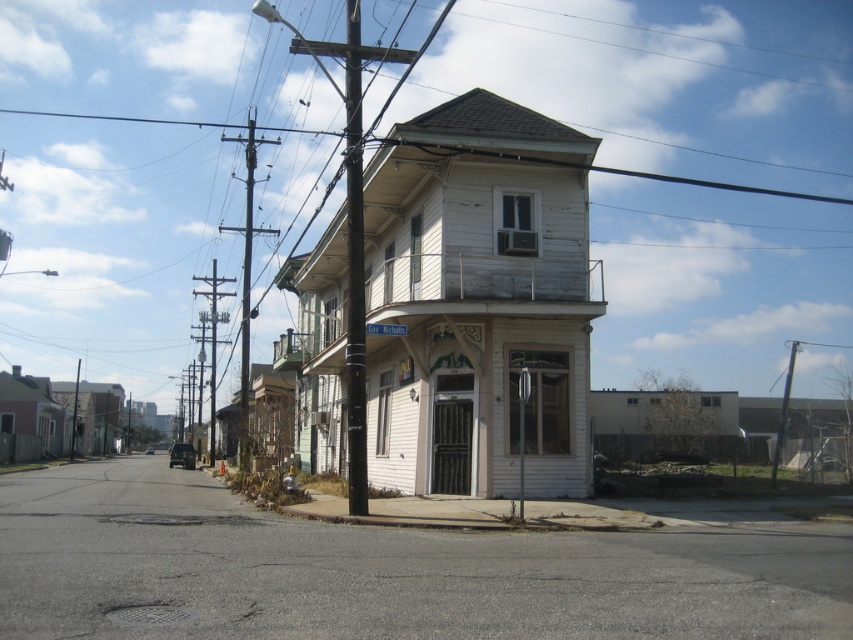
Is point (347, 52) positioned after point (244, 404)?

No, it is in front of (244, 404).

Does black painted wood utility pole at center have a lesser height compared to metallic utility pole at center-left?

No, black painted wood utility pole at center is not shorter than metallic utility pole at center-left.

Does point (347, 198) come in front of point (245, 272)?

Yes.

You are a GUI agent. You are given a task and a screenshot of the screen. Output one action in this format:
    pyautogui.click(x=<x>, y=<y>)
    Task: Click on the black painted wood utility pole at center
    
    Given the screenshot: What is the action you would take?
    click(354, 269)